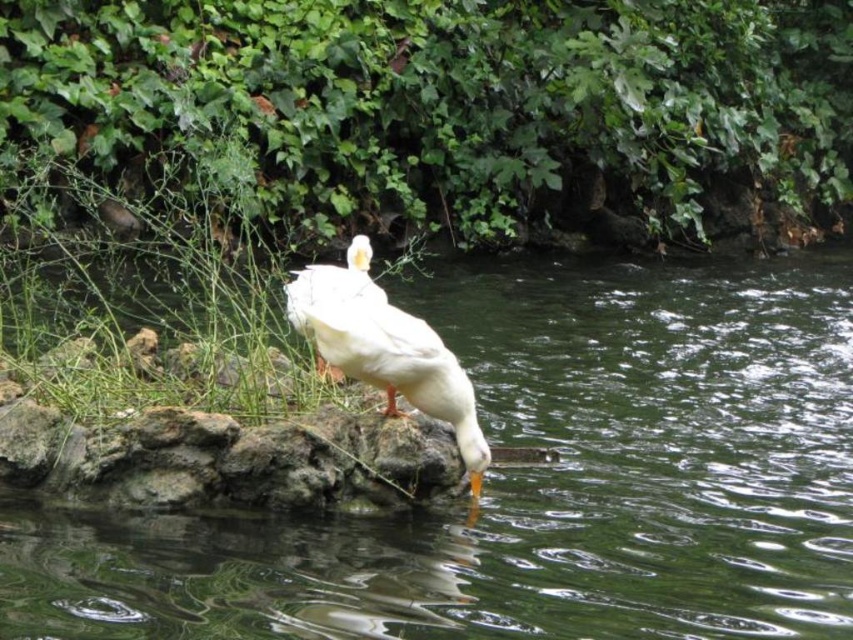
You are standing on the shore and see the clear liquid water at center and the white matte duck at center. Which object is closer to your right side?

The clear liquid water at center is to the right of the white matte duck at center, so the clear liquid water at center is closer to your right side.

In the serene natural scene, there are two objects of interest, the clear liquid water at center and the white matte duck at center. Which object takes up more space in the image?

The clear liquid water at center has a larger size compared to the white matte duck at center, so it takes up more space in the image.

You are a photographer aiming to capture the reflection of the white matte duck at center in the clear liquid water at center. Based on the scene, will the duck be fully visible in its reflection?

The clear liquid water at center is taller than white matte duck at center, so the duck will be fully visible in its reflection since the water depth is sufficient to accommodate its height.